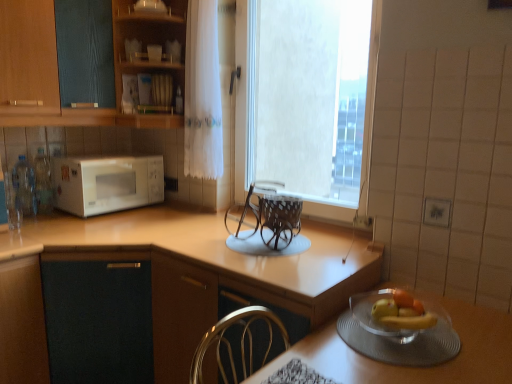
Where is `vacant space in between white matte microwave at left and clear glass bottle at left, which is the second bottle from left to right`? vacant space in between white matte microwave at left and clear glass bottle at left, which is the second bottle from left to right is located at coordinates (62, 215).